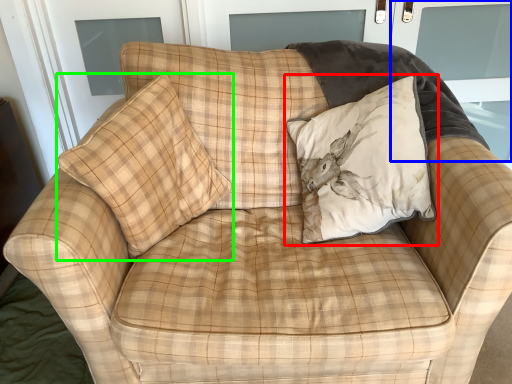
Question: Based on their relative distances, which object is nearer to pillow (highlighted by a red box)? Choose from screen door (highlighted by a blue box) and pillow (highlighted by a green box).

Choices:
 (A) screen door
 (B) pillow

Answer: (B)